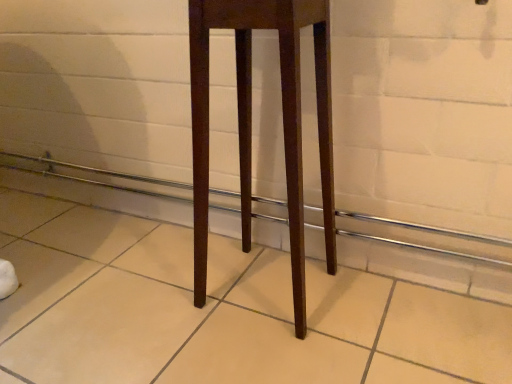
Locate an element on the screen. brown wooden balustrade at center is located at coordinates (98, 173).

This screenshot has height=384, width=512. What do you see at coordinates (98, 173) in the screenshot?
I see `brown wooden balustrade at center` at bounding box center [98, 173].

Measure the distance between brown wooden balustrade at center and camera.

A distance of 78.83 centimeters exists between brown wooden balustrade at center and camera.

Locate an element on the screen. The image size is (512, 384). mahogany wood stool at center is located at coordinates (251, 122).

Image resolution: width=512 pixels, height=384 pixels. What do you see at coordinates (251, 122) in the screenshot?
I see `mahogany wood stool at center` at bounding box center [251, 122].

Find the location of a particular element. brown wooden balustrade at center is located at coordinates (98, 173).

Which is more to the left, brown wooden balustrade at center or mahogany wood stool at center?

Positioned to the left is brown wooden balustrade at center.

Does brown wooden balustrade at center come behind mahogany wood stool at center?

Yes, it is behind mahogany wood stool at center.

Does point (273, 218) lie behind point (252, 26)?

Yes, it is behind point (252, 26).

From the image's perspective, which object appears higher, brown wooden balustrade at center or mahogany wood stool at center?

mahogany wood stool at center, from the image's perspective.

From a real-world perspective, which is physically above, brown wooden balustrade at center or mahogany wood stool at center?

From a 3D spatial view, mahogany wood stool at center is above.

Can you confirm if brown wooden balustrade at center is wider than mahogany wood stool at center?

Incorrect, the width of brown wooden balustrade at center does not surpass that of mahogany wood stool at center.

Based on the photo, is brown wooden balustrade at center shorter than mahogany wood stool at center?

Yes.

Is brown wooden balustrade at center smaller than mahogany wood stool at center?

Yes, brown wooden balustrade at center is smaller than mahogany wood stool at center.

Is brown wooden balustrade at center surrounding mahogany wood stool at center?

No, mahogany wood stool at center is not surrounded by brown wooden balustrade at center.

Is brown wooden balustrade at center next to mahogany wood stool at center?

No, brown wooden balustrade at center is not next to mahogany wood stool at center.

From the picture: Is brown wooden balustrade at center looking in the opposite direction of mahogany wood stool at center?

No, mahogany wood stool at center is not at the back of brown wooden balustrade at center.

Can you tell me how much brown wooden balustrade at center and mahogany wood stool at center differ in facing direction?

0.61 degrees separate the facing orientations of brown wooden balustrade at center and mahogany wood stool at center.

Identify the location of furniture that appears in front of the brown wooden balustrade at center. This screenshot has width=512, height=384. (251, 122).

Which object is positioned more to the left, mahogany wood stool at center or brown wooden balustrade at center?

brown wooden balustrade at center.

Who is more distant, mahogany wood stool at center or brown wooden balustrade at center?

brown wooden balustrade at center is further from the camera.

Between point (329, 225) and point (492, 258), which one is positioned in front?

The point (492, 258) is more forward.

From the image's perspective, which is above, mahogany wood stool at center or brown wooden balustrade at center?

mahogany wood stool at center appears higher in the image.

From a real-world perspective, which object stands above the other?

mahogany wood stool at center is physically above.

Based on the photo, which of these two, mahogany wood stool at center or brown wooden balustrade at center, is thinner?

With smaller width is brown wooden balustrade at center.

Considering the relative sizes of mahogany wood stool at center and brown wooden balustrade at center in the image provided, is mahogany wood stool at center taller than brown wooden balustrade at center?

Yes, mahogany wood stool at center is taller than brown wooden balustrade at center.

Who is bigger, mahogany wood stool at center or brown wooden balustrade at center?

Bigger between the two is mahogany wood stool at center.

Is mahogany wood stool at center located outside brown wooden balustrade at center?

Yes, mahogany wood stool at center is outside of brown wooden balustrade at center.

Is there a large distance between mahogany wood stool at center and brown wooden balustrade at center?

mahogany wood stool at center is near brown wooden balustrade at center, not far away.

Could you tell me if mahogany wood stool at center is facing brown wooden balustrade at center?

No, mahogany wood stool at center is not turned towards brown wooden balustrade at center.

What's the angular difference between mahogany wood stool at center and brown wooden balustrade at center's facing directions?

The angular difference between mahogany wood stool at center and brown wooden balustrade at center is 0.61 degrees.

How distant is mahogany wood stool at center from brown wooden balustrade at center?

The distance of mahogany wood stool at center from brown wooden balustrade at center is 10.08 inches.

This screenshot has width=512, height=384. In order to click on furniture in front of the brown wooden balustrade at center in this screenshot , I will do `click(251, 122)`.

In the image, there is a mahogany wood stool at center. Where is `balustrade below it (from a real-world perspective)`? Image resolution: width=512 pixels, height=384 pixels. balustrade below it (from a real-world perspective) is located at coordinates (98, 173).

At what (x,y) coordinates should I click in order to perform the action: click on furniture above the brown wooden balustrade at center (from the image's perspective). Please return your answer as a coordinate pair (x, y). Looking at the image, I should click on (251, 122).